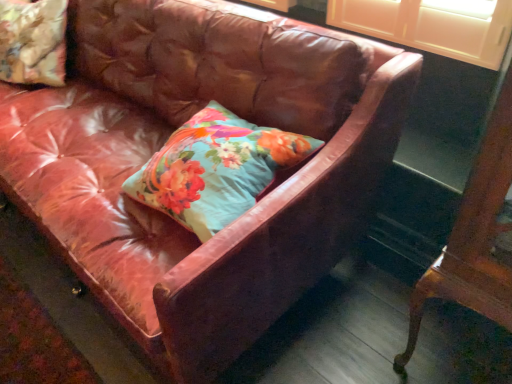
Identify the location of vacant space underneath mahogany wood table at right (from a real-world perspective). The height and width of the screenshot is (384, 512). [x=455, y=360].